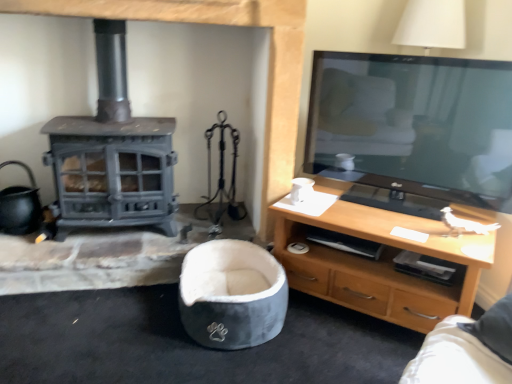
The image size is (512, 384). Find the location of `vacant area located to the right-hand side of velvet grey bean bag chair at center`. vacant area located to the right-hand side of velvet grey bean bag chair at center is located at coordinates (326, 342).